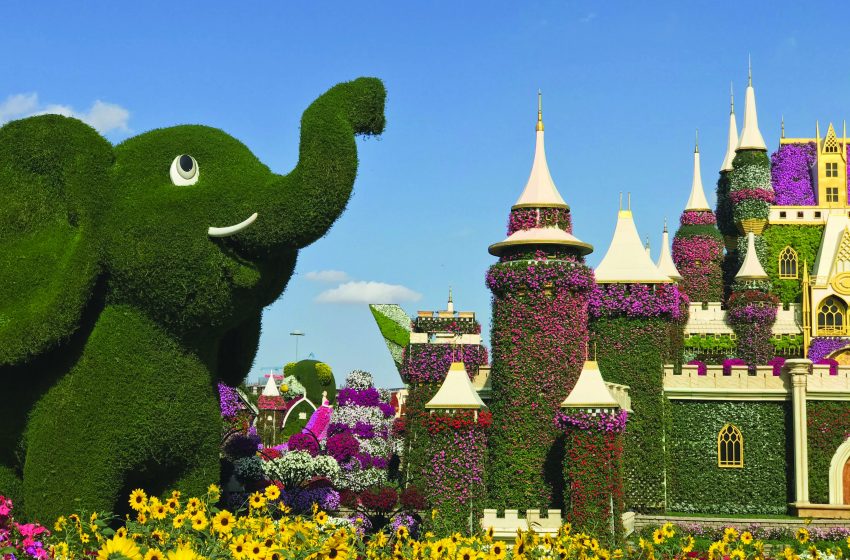
Locate an element on the screen. Image resolution: width=850 pixels, height=560 pixels. window is located at coordinates (727, 440), (828, 311), (788, 256), (830, 192), (830, 177), (828, 146).